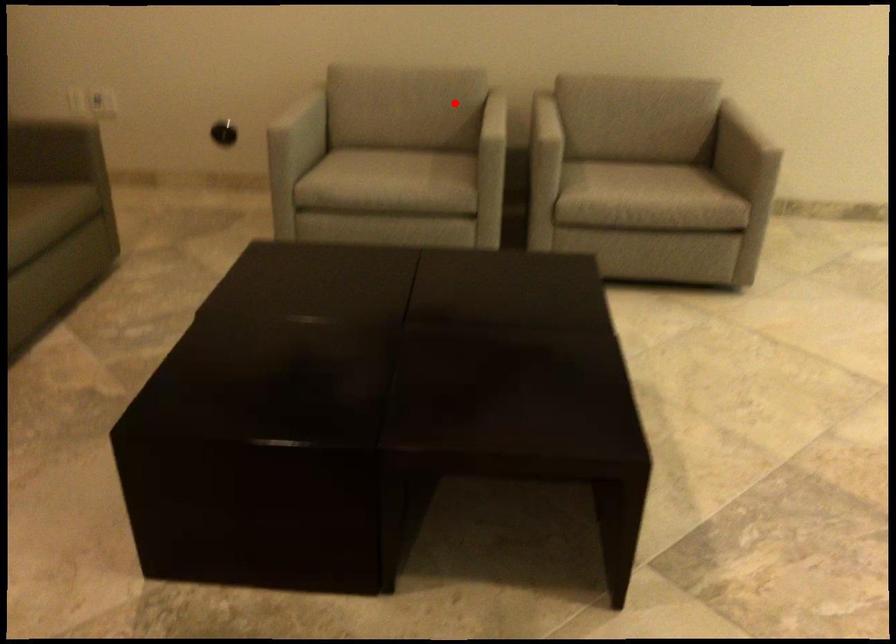
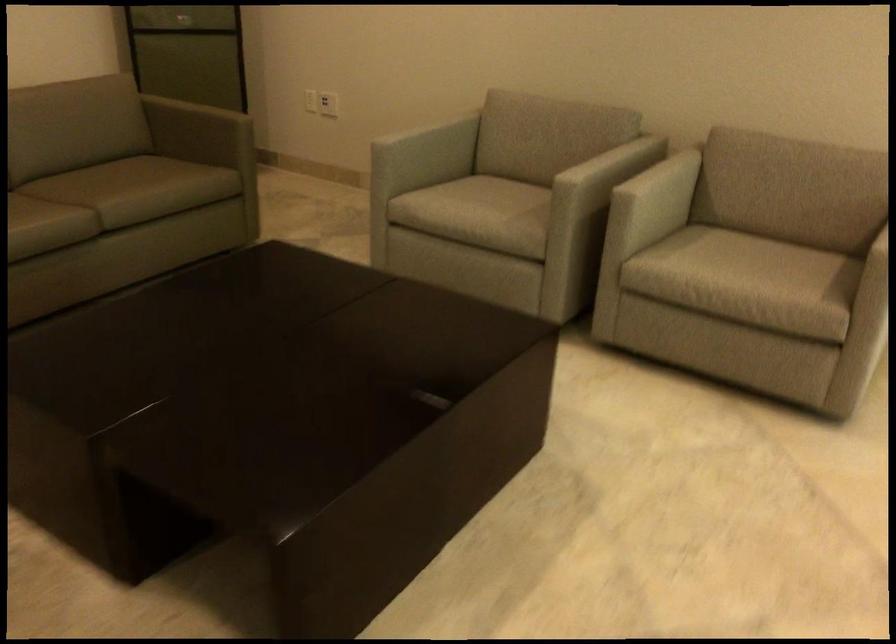
In the second image, find the point that corresponds to the highlighted location in the first image.

(588, 149)